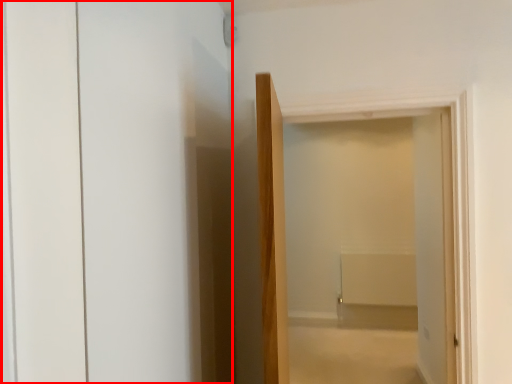
Question: Where is screen door (annotated by the red box) located in relation to door in the image?

Choices:
 (A) left
 (B) right

Answer: (A)